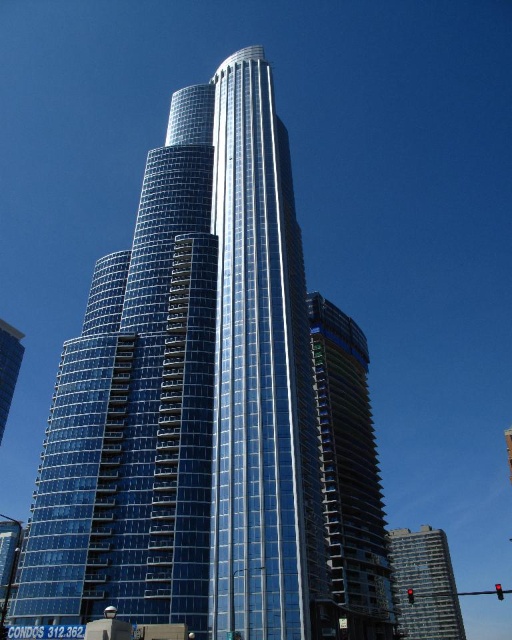
You are standing at the point marked as point (210, 410) in the image. What is the nearest object to you in the scene?

The transparent glass building at center is located at point (210, 410), so the nearest object to you is the transparent glass building at center.

You are an architect reviewing a 3D model of the skyscraper. You notice two points marked on the building facade. The first point is at coordinates point (283, 278) and the second at point (390, 545). Which of these points is closer to your viewpoint as you look at the model?

Point (283, 278) is closer to the camera than point (390, 545).

You are a drone operator planning to fly a drone between the transparent glass building at center and the clear glass building at lower right. The drone has a maximum flight distance of 60 meters. Based on the scene, will the drone be able to make the trip without recharging?

The transparent glass building at center and the clear glass building at lower right are 67.18 meters apart. Since the drone can only fly 60 meters before needing to recharge, it cannot make the trip without recharging.